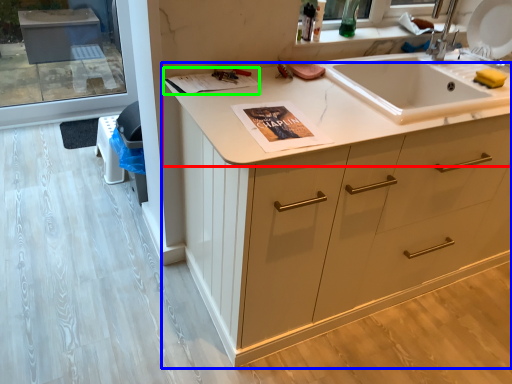
Question: Based on their relative distances, which object is farther from countertop (highlighted by a red box)? Choose from cabinetry (highlighted by a blue box) and magazine (highlighted by a green box).

Choices:
 (A) cabinetry
 (B) magazine

Answer: (A)